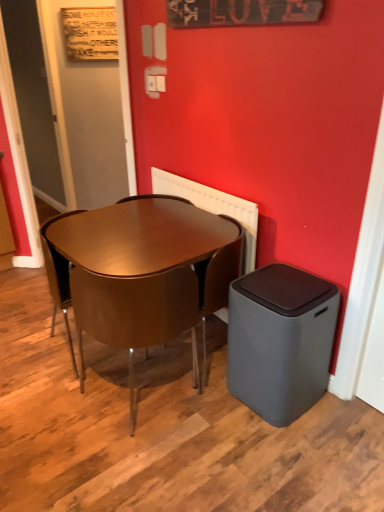
Identify the location of vacant area that is in front of brown leather chair at center, which is the 2th chair in left-to-right order. The height and width of the screenshot is (512, 384). (143, 459).